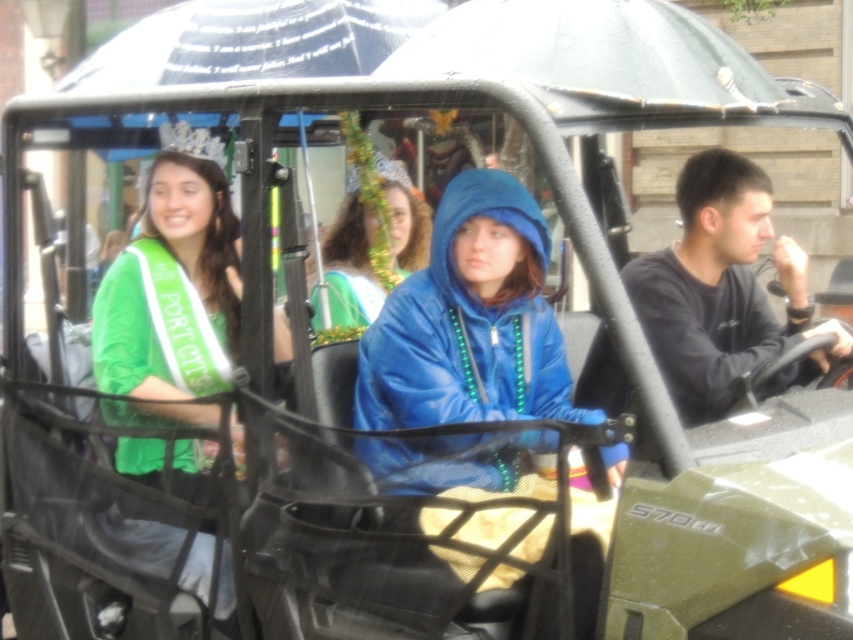
Based on the scene, which object is positioned lower in the vehicle? The green satin sash at left or the dark gray sweatshirt at right?

The green satin sash at left is located below dark gray sweatshirt at right, so it is positioned lower in the vehicle.